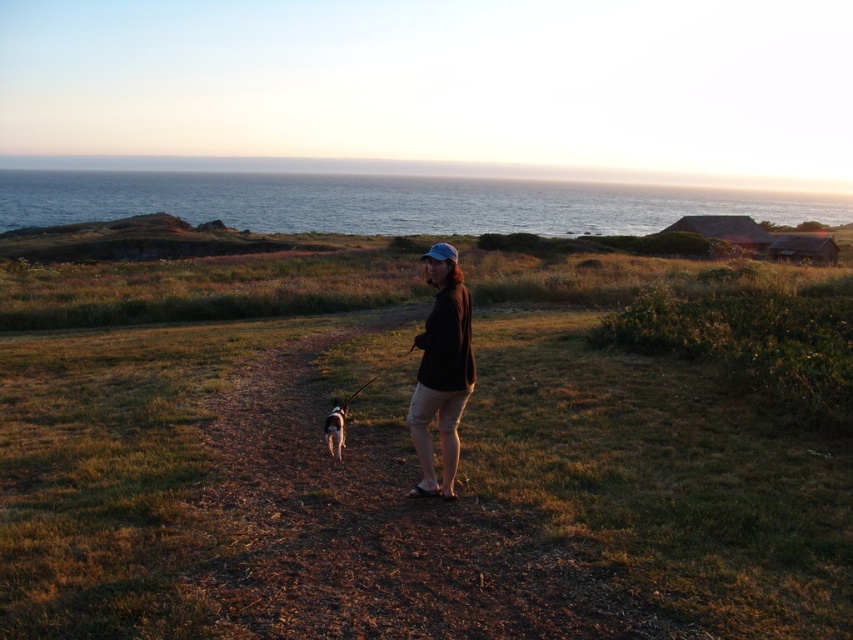
Is brown dirt path at center wider than white fur dog at center?

Correct, the width of brown dirt path at center exceeds that of white fur dog at center.

Find the location of a particular element. The height and width of the screenshot is (640, 853). brown dirt path at center is located at coordinates (378, 529).

Which is behind, point (566, 589) or point (329, 419)?

Point (329, 419)

You are a GUI agent. You are given a task and a screenshot of the screen. Output one action in this format:
    pyautogui.click(x=<x>, y=<y>)
    Task: Click on the brown dirt path at center
    This screenshot has height=640, width=853.
    Given the screenshot: What is the action you would take?
    pyautogui.click(x=378, y=529)

Who is lower down, green grassy at center or white fur dog at center?

Positioned lower is white fur dog at center.

Is point (112, 342) less distant than point (340, 433)?

No, (112, 342) is behind (340, 433).

The image size is (853, 640). What do you see at coordinates (207, 451) in the screenshot?
I see `green grassy at center` at bounding box center [207, 451].

Where is `green grassy at center`? Image resolution: width=853 pixels, height=640 pixels. green grassy at center is located at coordinates (207, 451).

Between green grassy at center and brown matte jacket at center, which one is positioned higher?

green grassy at center is higher up.

Locate an element on the screen. The height and width of the screenshot is (640, 853). green grassy at center is located at coordinates (207, 451).